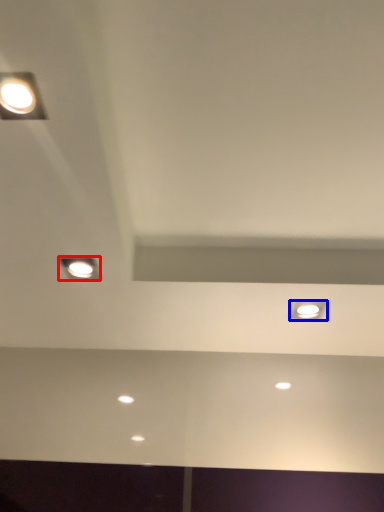
Question: Which point is closer to the camera, lamp (highlighted by a red box) or dot (highlighted by a blue box)?

Choices:
 (A) lamp
 (B) dot

Answer: (A)